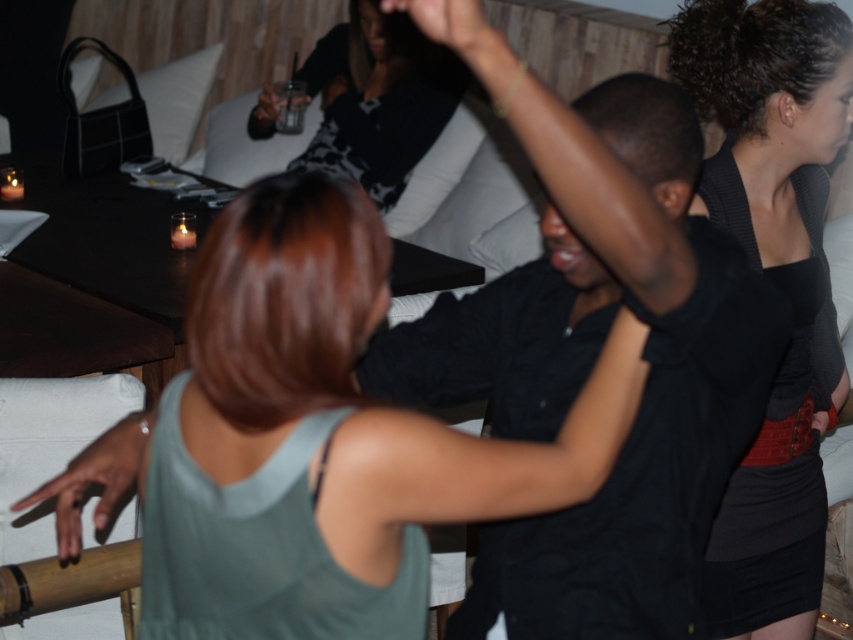
Is black matte dress at upper right positioned at the back of clear plastic cup at upper center?

No.

Can you confirm if black matte dress at upper right is smaller than clear plastic cup at upper center?

Actually, black matte dress at upper right might be larger than clear plastic cup at upper center.

What do you see at coordinates (495, 212) in the screenshot? Image resolution: width=853 pixels, height=640 pixels. I see `black matte dress at upper right` at bounding box center [495, 212].

Find the location of `black matte dress at upper right`. black matte dress at upper right is located at coordinates (495, 212).

Which is more to the left, black matte dress at upper right or dark skin hand at lower left?

dark skin hand at lower left is more to the left.

How distant is black matte dress at upper right from dark skin hand at lower left?

The distance of black matte dress at upper right from dark skin hand at lower left is 2.15 meters.

Is point (555, 188) positioned after point (74, 499)?

That is False.

Identify the location of black matte dress at upper right. (495, 212).

Consider the image. Can you confirm if black knit dress at upper right is positioned to the left of dark skin hand at lower left?

Incorrect, black knit dress at upper right is not on the left side of dark skin hand at lower left.

Between point (741, 548) and point (96, 509), which one is positioned behind?

The point (741, 548) is more distant.

Between point (801, 588) and point (148, 432), which one is positioned behind?

Positioned behind is point (801, 588).

You are a GUI agent. You are given a task and a screenshot of the screen. Output one action in this format:
    pyautogui.click(x=<x>, y=<y>)
    Task: Click on the black knit dress at upper right
    The height and width of the screenshot is (640, 853).
    Given the screenshot: What is the action you would take?
    pyautogui.click(x=775, y=282)